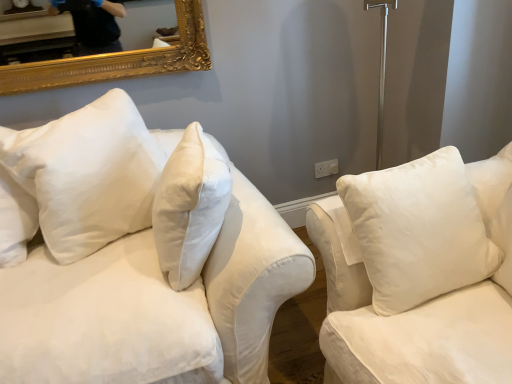
You are a GUI agent. You are given a task and a screenshot of the screen. Output one action in this format:
    pyautogui.click(x=<x>, y=<y>)
    Task: Click on the white plastic electric outlet at center-right
    
    Given the screenshot: What is the action you would take?
    pyautogui.click(x=326, y=168)

This screenshot has height=384, width=512. What do you see at coordinates (418, 230) in the screenshot?
I see `white soft cushion at right, the 1th pillow viewed from the right` at bounding box center [418, 230].

Identify the location of white soft cushion at right, placed as the second pillow when sorted from left to right. (418, 230).

Image resolution: width=512 pixels, height=384 pixels. In order to click on white plastic electric outlet at center-right in this screenshot , I will do (326, 168).

Which point is more forward, [339,184] or [323,166]?

Positioned in front is point [339,184].

Considering the relative positions of white soft cushion at right, the 1th pillow viewed from the right, and white plastic electric outlet at center-right in the image provided, is white soft cushion at right, the 1th pillow viewed from the right, to the right of white plastic electric outlet at center-right from the viewer's perspective?

Correct, you'll find white soft cushion at right, the 1th pillow viewed from the right, to the right of white plastic electric outlet at center-right.

From the image's perspective, is white soft cushion at right, placed as the second pillow when sorted from left to right, located above or below white plastic electric outlet at center-right?

Clearly, from the image's perspective, white soft cushion at right, placed as the second pillow when sorted from left to right, is below white plastic electric outlet at center-right.

In the scene shown: Is white soft cushion at right, the 1th pillow viewed from the right, bigger than white plastic electric outlet at center-right?

Yes, white soft cushion at right, the 1th pillow viewed from the right, is bigger than white plastic electric outlet at center-right.

Is white plastic electric outlet at center-right at the back of white cotton couch at left?

No.

In terms of size, does white cotton couch at left appear bigger or smaller than white plastic electric outlet at center-right?

Considering their sizes, white cotton couch at left takes up more space than white plastic electric outlet at center-right.

Based on the photo, is white cotton couch at left completely or partially outside of white plastic electric outlet at center-right?

white cotton couch at left lies outside white plastic electric outlet at center-right's area.

Which is nearer, (97, 274) or (315, 169)?

→ Point (97, 274).

Considering the relative positions of white soft cushion at right, placed as the second pillow when sorted from left to right, and white cotton pillow at upper left, the 1th pillow positioned from the left, in the image provided, is white soft cushion at right, placed as the second pillow when sorted from left to right, to the left of white cotton pillow at upper left, the 1th pillow positioned from the left, from the viewer's perspective?

Incorrect, white soft cushion at right, placed as the second pillow when sorted from left to right, is not on the left side of white cotton pillow at upper left, the 1th pillow positioned from the left.

Which of these two, white soft cushion at right, placed as the second pillow when sorted from left to right, or white cotton pillow at upper left, the 1th pillow positioned from the left, stands taller?

white cotton pillow at upper left, the 1th pillow positioned from the left, is taller.

From the image's perspective, is white soft cushion at right, the 1th pillow viewed from the right, located above white cotton pillow at upper left, the 1th pillow positioned from the left?

Incorrect, from the image's perspective, white soft cushion at right, the 1th pillow viewed from the right, is lower than white cotton pillow at upper left, the 1th pillow positioned from the left.

From the picture: Can you confirm if white soft cushion at right, the 1th pillow viewed from the right, is bigger than white cotton pillow at upper left, the 1th pillow positioned from the left?

Incorrect, white soft cushion at right, the 1th pillow viewed from the right, is not larger than white cotton pillow at upper left, the 1th pillow positioned from the left.

Considering the sizes of objects white cotton couch at left and white soft cushion at right, the 1th pillow viewed from the right, in the image provided, who is smaller, white cotton couch at left or white soft cushion at right, the 1th pillow viewed from the right,?

Smaller between the two is white soft cushion at right, the 1th pillow viewed from the right.

Is white cotton couch at left turned away from white soft cushion at right, the 1th pillow viewed from the right?

That's not correct — white cotton couch at left is not looking away from white soft cushion at right, the 1th pillow viewed from the right.

Considering the relative sizes of white cotton couch at left and white soft cushion at right, the 1th pillow viewed from the right, in the image provided, is white cotton couch at left shorter than white soft cushion at right, the 1th pillow viewed from the right,?

In fact, white cotton couch at left may be taller than white soft cushion at right, the 1th pillow viewed from the right.

From the image's perspective, is white plastic electric outlet at center-right located above or below white cotton pillow at upper left, the 1th pillow positioned from the left?

Clearly, from the image's perspective, white plastic electric outlet at center-right is above white cotton pillow at upper left, the 1th pillow positioned from the left.

Who is smaller, white plastic electric outlet at center-right or white cotton pillow at upper left, the second pillow positioned from the right?

white plastic electric outlet at center-right is smaller.

Who is more distant, white plastic electric outlet at center-right or white cotton pillow at upper left, the second pillow positioned from the right?

white plastic electric outlet at center-right is more distant.

From a real-world perspective, which is physically above, white plastic electric outlet at center-right or white cotton pillow at upper left, the second pillow positioned from the right?

white cotton pillow at upper left, the second pillow positioned from the right, is physically above.

Who is more distant, white cotton pillow at upper left, the second pillow positioned from the right, or white cotton couch at left?

white cotton pillow at upper left, the second pillow positioned from the right, is further from the camera.

From a real-world perspective, who is located higher, white cotton pillow at upper left, the 1th pillow positioned from the left, or white cotton couch at left?

white cotton pillow at upper left, the 1th pillow positioned from the left, from a real-world perspective.

Can you confirm if white cotton pillow at upper left, the 1th pillow positioned from the left, is bigger than white cotton couch at left?

No, white cotton pillow at upper left, the 1th pillow positioned from the left, is not bigger than white cotton couch at left.

From a real-world perspective, is white plastic electric outlet at center-right below white soft cushion at right, placed as the second pillow when sorted from left to right?

Indeed, from a real-world perspective, white plastic electric outlet at center-right is positioned beneath white soft cushion at right, placed as the second pillow when sorted from left to right.

Between white plastic electric outlet at center-right and white soft cushion at right, the 1th pillow viewed from the right, which one has more height?

Standing taller between the two is white soft cushion at right, the 1th pillow viewed from the right.

Is the depth of white plastic electric outlet at center-right greater than that of white soft cushion at right, the 1th pillow viewed from the right?

That is True.

Can you tell me how much white plastic electric outlet at center-right and white soft cushion at right, placed as the second pillow when sorted from left to right, differ in facing direction?

90 degrees.

Where is `electric outlet located above the white soft cushion at right, placed as the second pillow when sorted from left to right (from the image's perspective)`? This screenshot has height=384, width=512. electric outlet located above the white soft cushion at right, placed as the second pillow when sorted from left to right (from the image's perspective) is located at coordinates (326, 168).

This screenshot has height=384, width=512. Find the location of `electric outlet that appears behind the white cotton couch at left`. electric outlet that appears behind the white cotton couch at left is located at coordinates tap(326, 168).

Which object lies further to the anchor point white cotton couch at left, white plastic electric outlet at center-right or white soft cushion at right, placed as the second pillow when sorted from left to right?

white plastic electric outlet at center-right is positioned further to the anchor white cotton couch at left.

Which object lies further to the anchor point white cotton pillow at upper left, the 1th pillow positioned from the left, white plastic electric outlet at center-right or white cotton couch at left?

white plastic electric outlet at center-right is further to white cotton pillow at upper left, the 1th pillow positioned from the left.

Estimate the real-world distances between objects in this image. Which object is further from white plastic electric outlet at center-right, white soft cushion at right, the 1th pillow viewed from the right, or white cotton couch at left?

Among the two, white cotton couch at left is located further to white plastic electric outlet at center-right.

Estimate the real-world distances between objects in this image. Which object is closer to white cotton couch at left, white soft cushion at right, placed as the second pillow when sorted from left to right, or white cotton pillow at upper left, the second pillow positioned from the right?

white cotton pillow at upper left, the second pillow positioned from the right, is closer to white cotton couch at left.

Which object lies further to the anchor point white cotton pillow at upper left, the 1th pillow positioned from the left, white cotton couch at left or white plastic electric outlet at center-right?

The object further to white cotton pillow at upper left, the 1th pillow positioned from the left, is white plastic electric outlet at center-right.

From the image, which object appears to be nearer to white soft cushion at right, placed as the second pillow when sorted from left to right, white plastic electric outlet at center-right or white cotton couch at left?

white cotton couch at left.

When comparing their distances from white plastic electric outlet at center-right, does white cotton couch at left or white soft cushion at right, placed as the second pillow when sorted from left to right, seem closer?

white soft cushion at right, placed as the second pillow when sorted from left to right, is closer to white plastic electric outlet at center-right.

Which object lies nearer to the anchor point white soft cushion at right, placed as the second pillow when sorted from left to right, white cotton pillow at upper left, the second pillow positioned from the right, or white cotton couch at left?

The object closer to white soft cushion at right, placed as the second pillow when sorted from left to right, is white cotton couch at left.

Locate an element on the screen. pillow positioned between white soft cushion at right, the 1th pillow viewed from the right, and white plastic electric outlet at center-right from near to far is located at coordinates (87, 174).

Where is `studio couch situated between white cotton pillow at upper left, the 1th pillow positioned from the left, and white soft cushion at right, placed as the second pillow when sorted from left to right, from left to right`? The image size is (512, 384). studio couch situated between white cotton pillow at upper left, the 1th pillow positioned from the left, and white soft cushion at right, placed as the second pillow when sorted from left to right, from left to right is located at coordinates (137, 255).